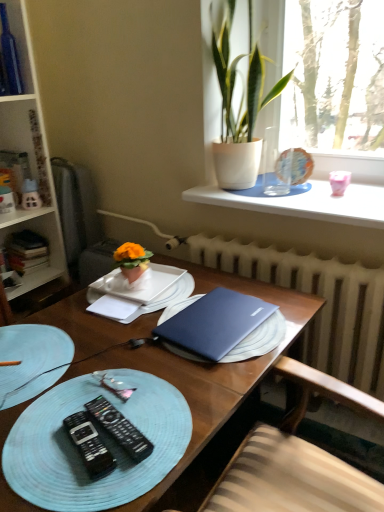
The image size is (384, 512). Find the location of `vacant space that is to the left of matte glass globe at upper right, which is the 2th tableware in left-to-right order`. vacant space that is to the left of matte glass globe at upper right, which is the 2th tableware in left-to-right order is located at coordinates (259, 187).